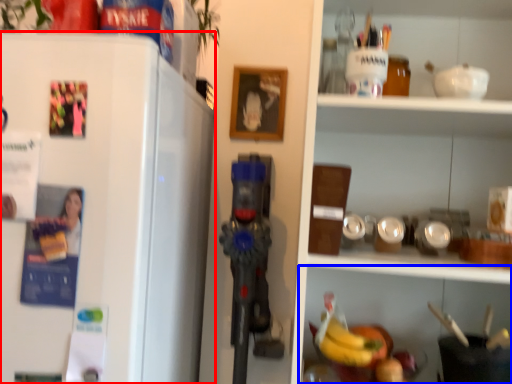
Question: Which point is further to the camera, refrigerator (highlighted by a red box) or shelf (highlighted by a blue box)?

Choices:
 (A) refrigerator
 (B) shelf

Answer: (B)